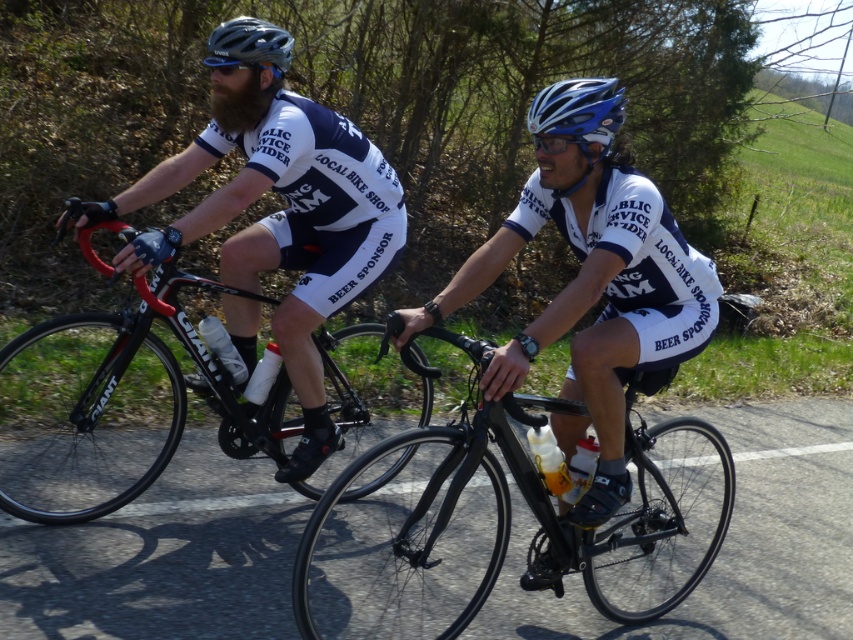
Question: Is shiny black frame at left to the right of shiny blue helmet at center from the viewer's perspective?

Choices:
 (A) yes
 (B) no

Answer: (B)

Question: Which object appears farthest from the camera in this image?

Choices:
 (A) shiny blue helmet at upper center
 (B) black matte bicycle at center
 (C) blue glossy helmet at center

Answer: (A)

Question: Which object is closer to the camera taking this photo?

Choices:
 (A) black matte bicycle at center
 (B) shiny blue helmet at upper center
 (C) shiny blue helmet at center
 (D) shiny black frame at left

Answer: (A)

Question: Can you confirm if black matte bicycle at center is positioned above matte blue helmet at upper center?

Choices:
 (A) yes
 (B) no

Answer: (B)

Question: Among these objects, which one is nearest to the camera?

Choices:
 (A) blue glossy helmet at center
 (B) shiny blue helmet at upper center
 (C) shiny blue helmet at center
 (D) shiny black frame at left

Answer: (C)

Question: Does shiny black frame at left appear on the right side of shiny blue helmet at upper center?

Choices:
 (A) no
 (B) yes

Answer: (A)